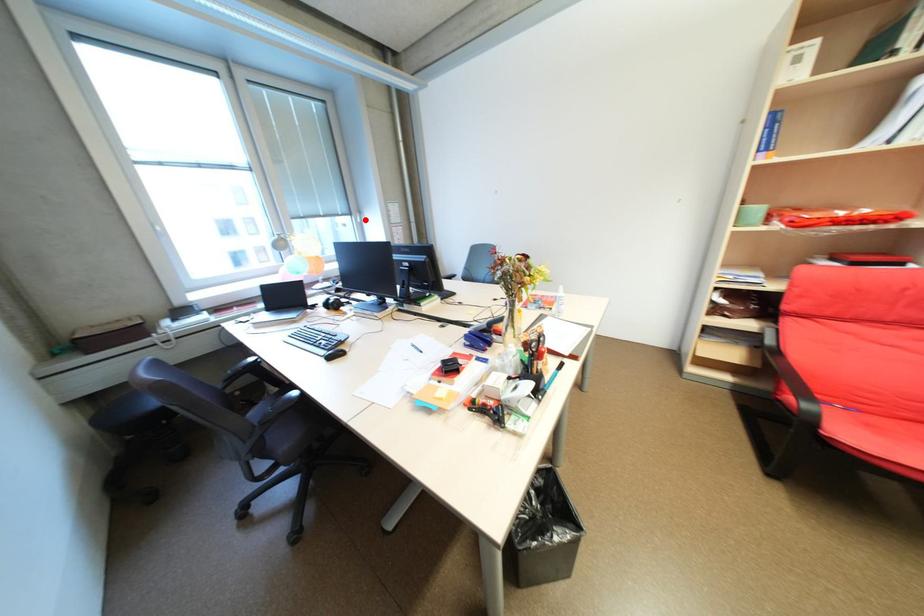
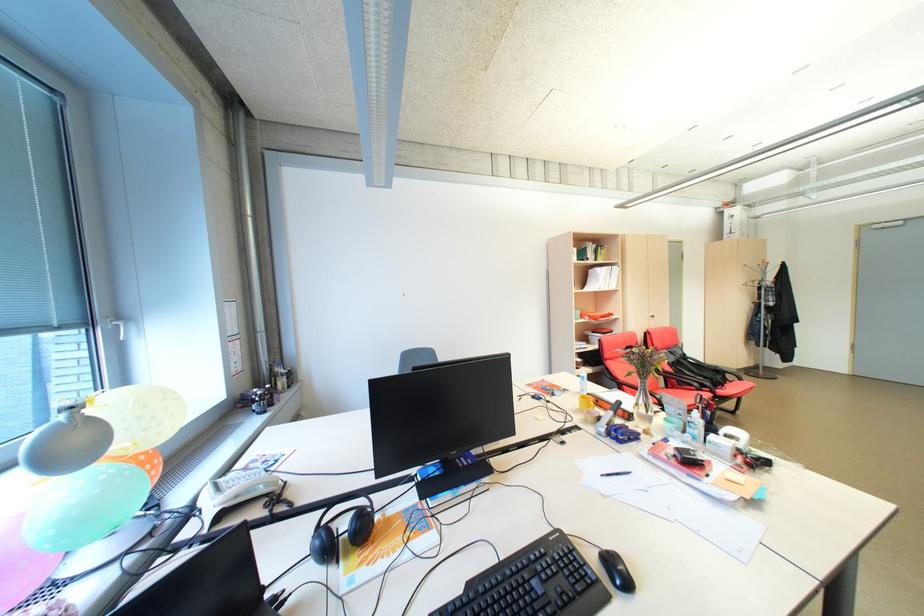
Question: A red point is marked in image1. In image2, is the corresponding 3D point closer to the camera or farther? Reply with the corresponding letter.

Choices:
 (A) The corresponding 3D point is closer.
 (B) The corresponding 3D point is farther.

Answer: (B)